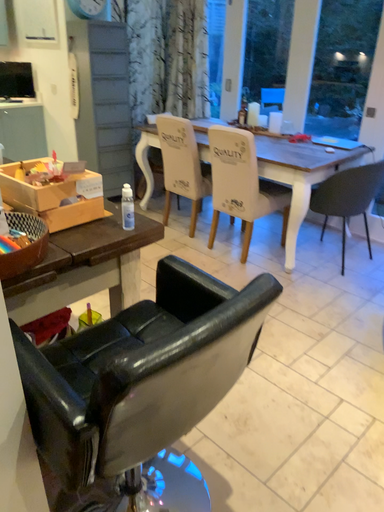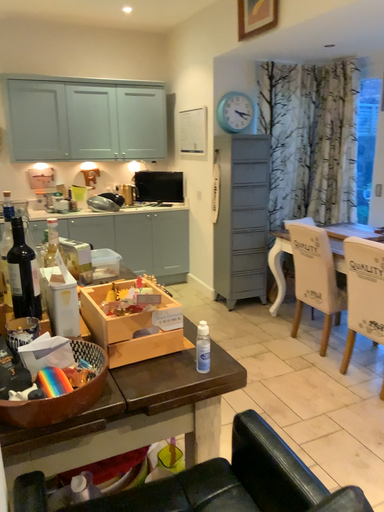
Question: Which way did the camera rotate in the video?

Choices:
 (A) rotated right
 (B) rotated left

Answer: (B)